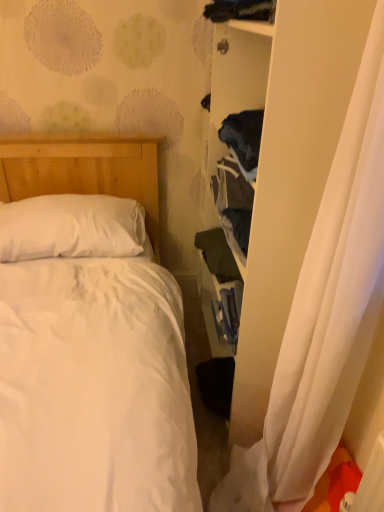
Question: From the image's perspective, is dark blue fabric at upper center, acting as the second clothing starting from the back, located above or below white sheer curtain at right?

Choices:
 (A) below
 (B) above

Answer: (B)

Question: Does point (261, 17) appear closer or farther from the camera than point (382, 204)?

Choices:
 (A) closer
 (B) farther

Answer: (B)

Question: Which is nearer to the dark blue fabric at upper center, the second clothing in the bottom-to-top sequence?

Choices:
 (A) white soft pillow at upper left
 (B) dark green fabric at center-right, the 2th clothing when ordered from top to bottom
 (C) white sheer curtain at right

Answer: (B)

Question: Based on their relative distances, which object is farther from the white soft pillow at upper left?

Choices:
 (A) dark blue fabric at upper center, the second clothing in the bottom-to-top sequence
 (B) dark green fabric at center-right, placed as the 1th clothing when sorted from bottom to top
 (C) white sheer curtain at right

Answer: (A)